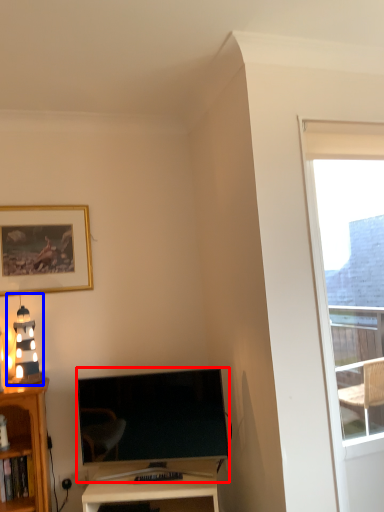
Question: Which object appears farthest to the camera in this image, television (highlighted by a red box) or light fixture (highlighted by a blue box)?

Choices:
 (A) television
 (B) light fixture

Answer: (B)